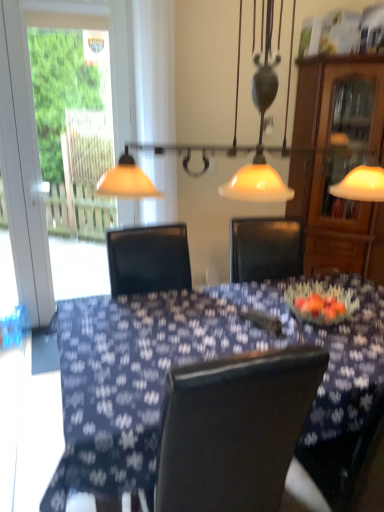
What is the approximate width of transparent glass screen door at left?

It is 1.82 inches.

Where is `blue fabric table at center`? This screenshot has height=512, width=384. blue fabric table at center is located at coordinates (190, 360).

Is transparent glass screen door at left in front of or behind blue fabric table at center in the image?

In the image, transparent glass screen door at left appears behind blue fabric table at center.

Considering the relative sizes of transparent glass screen door at left and blue fabric table at center in the image provided, is transparent glass screen door at left thinner than blue fabric table at center?

Correct, the width of transparent glass screen door at left is less than that of blue fabric table at center.

Who is shorter, transparent glass screen door at left or blue fabric table at center?

Standing shorter between the two is blue fabric table at center.

I want to click on table below the transparent glass screen door at left (from the image's perspective), so click(190, 360).

Is matte glass pendant light at upper center taller or shorter than transparent glass screen door at left?

Considering their sizes, matte glass pendant light at upper center has less height than transparent glass screen door at left.

From the image's perspective, is matte glass pendant light at upper center located beneath transparent glass screen door at left?

No, from the image's perspective, matte glass pendant light at upper center is not beneath transparent glass screen door at left.

Identify the location of lamp above the transparent glass screen door at left (from the image's perspective). (222, 145).

From the image's perspective, is blue fabric table at center located above or below transparent glass screen door at left?

From the image's perspective, blue fabric table at center appears below transparent glass screen door at left.

Does blue fabric table at center have a larger size compared to transparent glass screen door at left?

Indeed, blue fabric table at center has a larger size compared to transparent glass screen door at left.

Is blue fabric table at center completely or partially outside of transparent glass screen door at left?

Yes, blue fabric table at center is not within transparent glass screen door at left.

Which object is positioned more to the left, transparent glass screen door at left or wooden cabinet at right?

transparent glass screen door at left is more to the left.

From the image's perspective, is transparent glass screen door at left above or below wooden cabinet at right?

transparent glass screen door at left is above wooden cabinet at right.

I want to click on screen door behind the wooden cabinet at right, so click(x=35, y=126).

Can you tell me how much transparent glass screen door at left and wooden cabinet at right differ in facing direction?

42.5 degrees separate the facing orientations of transparent glass screen door at left and wooden cabinet at right.

Is blue fabric table at center thinner than wooden cabinet at right?

Incorrect, the width of blue fabric table at center is not less than that of wooden cabinet at right.

Choose the correct answer: Is blue fabric table at center inside wooden cabinet at right or outside it?

blue fabric table at center lies outside wooden cabinet at right.

Can you confirm if blue fabric table at center is positioned to the left of wooden cabinet at right?

Yes, blue fabric table at center is to the left of wooden cabinet at right.

Does blue fabric table at center turn towards wooden cabinet at right?

No, blue fabric table at center is not aimed at wooden cabinet at right.

Between wooden cabinet at right and blue fabric table at center, which one has more height?

wooden cabinet at right is taller.

From a real-world perspective, does wooden cabinet at right stand above blue fabric table at center?

Indeed, from a real-world perspective, wooden cabinet at right stands above blue fabric table at center.

From the image's perspective, which one is positioned lower, wooden cabinet at right or blue fabric table at center?

blue fabric table at center, from the image's perspective.

Considering the sizes of objects wooden cabinet at right and transparent glass screen door at left in the image provided, who is smaller, wooden cabinet at right or transparent glass screen door at left?

transparent glass screen door at left.

Which is behind, point (332, 221) or point (29, 126)?

The point (332, 221) is farther from the camera.

Can you see wooden cabinet at right touching transparent glass screen door at left?

No.

Looking at this image, which of these two, wooden cabinet at right or transparent glass screen door at left, is thinner?

transparent glass screen door at left.

At what (x,y) coordinates should I click in order to perform the action: click on table that appears on the right of transparent glass screen door at left. Please return your answer as a coordinate pair (x, y). Looking at the image, I should click on (190, 360).

Identify the location of screen door that appears behind the matte glass pendant light at upper center. This screenshot has height=512, width=384. (35, 126).

Based on their spatial positions, is transparent glass screen door at left or matte glass pendant light at upper center further from wooden cabinet at right?

Among the two, transparent glass screen door at left is located further to wooden cabinet at right.

Consider the image. Looking at the image, which one is located closer to blue fabric table at center, matte glass pendant light at upper center or transparent glass screen door at left?

matte glass pendant light at upper center is positioned closer to the anchor blue fabric table at center.

Estimate the real-world distances between objects in this image. Which object is closer to wooden cabinet at right, matte glass pendant light at upper center or transparent glass screen door at left?

matte glass pendant light at upper center.

From the image, which object appears to be farther from matte glass pendant light at upper center, wooden cabinet at right or transparent glass screen door at left?

The object further to matte glass pendant light at upper center is transparent glass screen door at left.

Looking at the image, which one is located closer to blue fabric table at center, wooden cabinet at right or matte glass pendant light at upper center?

Among the two, matte glass pendant light at upper center is located nearer to blue fabric table at center.

Which object lies nearer to the anchor point blue fabric table at center, transparent glass screen door at left or wooden cabinet at right?

wooden cabinet at right is closer to blue fabric table at center.

Looking at the image, which one is located closer to wooden cabinet at right, blue fabric table at center or transparent glass screen door at left?

blue fabric table at center.

Considering their positions, is wooden cabinet at right positioned further to blue fabric table at center than transparent glass screen door at left?

transparent glass screen door at left.

Locate an element on the screen. lamp between blue fabric table at center and wooden cabinet at right in the front-back direction is located at coordinates (222, 145).

Identify the location of lamp between transparent glass screen door at left and wooden cabinet at right. The width and height of the screenshot is (384, 512). (222, 145).

Locate an element on the screen. The height and width of the screenshot is (512, 384). table between transparent glass screen door at left and wooden cabinet at right is located at coordinates (190, 360).

Image resolution: width=384 pixels, height=512 pixels. What are the coordinates of `lamp located between blue fabric table at center and transparent glass screen door at left in the depth direction` in the screenshot? It's located at (222, 145).